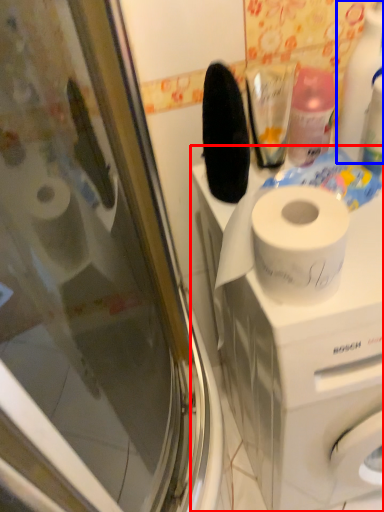
Question: Which object appears closest to the camera in this image, washing machine (highlighted by a red box) or cleaning product (highlighted by a blue box)?

Choices:
 (A) washing machine
 (B) cleaning product

Answer: (A)